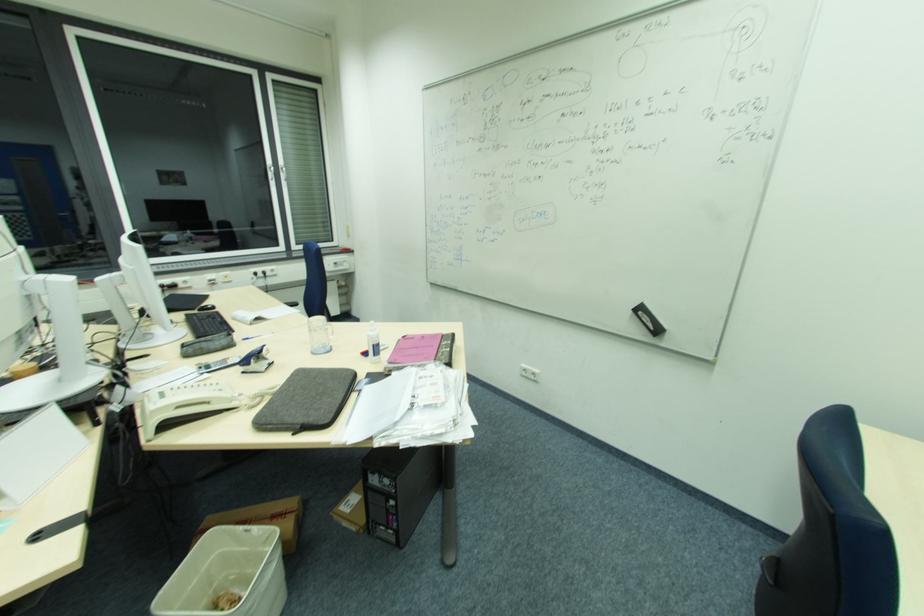
Locate an element on the screen. The width and height of the screenshot is (924, 616). pink notebook is located at coordinates (415, 349).